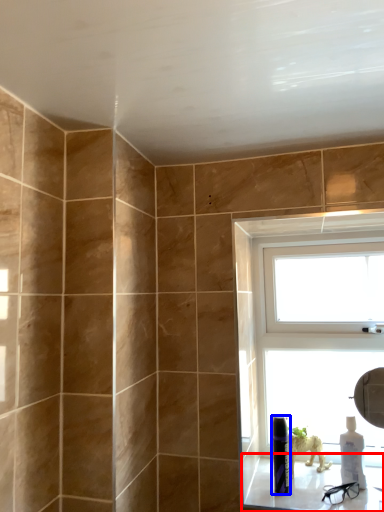
Question: Which object appears farthest to the camera in this image, window sill (highlighted by a red box) or toiletry (highlighted by a blue box)?

Choices:
 (A) window sill
 (B) toiletry

Answer: (B)